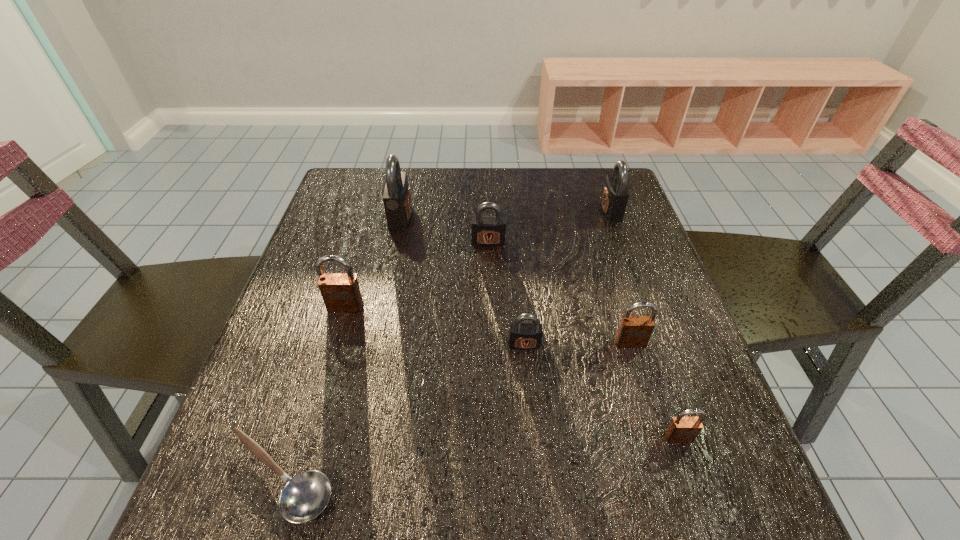
In the image, there is a desktop. Where is `vacant space at the left edge`? The width and height of the screenshot is (960, 540). vacant space at the left edge is located at coordinates (324, 235).

In the image, there is a desktop. Where is `blank space at the right edge`? This screenshot has height=540, width=960. blank space at the right edge is located at coordinates (600, 220).

Image resolution: width=960 pixels, height=540 pixels. In the image, there is a desktop. Find the location of `vacant space at the far right corner`. vacant space at the far right corner is located at coordinates (605, 179).

Where is `vacant area that lies between the second biggest brown padlock and the rightmost gray padlock`? vacant area that lies between the second biggest brown padlock and the rightmost gray padlock is located at coordinates (621, 276).

The image size is (960, 540). In order to click on blank region between the biggest brown padlock and the smallest brown padlock in this screenshot , I will do `click(512, 372)`.

The image size is (960, 540). What are the coordinates of `vacant area between the nearest gray padlock and the third farthest object` in the screenshot? It's located at (506, 293).

I want to click on empty location between the second padlock from left to right and the smallest gray padlock, so click(462, 280).

Where is `vacant region between the second farthest brown padlock and the third biggest gray padlock`? This screenshot has height=540, width=960. vacant region between the second farthest brown padlock and the third biggest gray padlock is located at coordinates (560, 292).

You are a GUI agent. You are given a task and a screenshot of the screen. Output one action in this format:
    pyautogui.click(x=<x>, y=<y>)
    Task: Click on the vacant space that is in between the nearest gray padlock and the third farthest padlock
    The image size is (960, 540).
    Given the screenshot: What is the action you would take?
    pyautogui.click(x=506, y=293)

Image resolution: width=960 pixels, height=540 pixels. I want to click on free space between the fifth nearest padlock and the leftmost padlock, so click(417, 274).